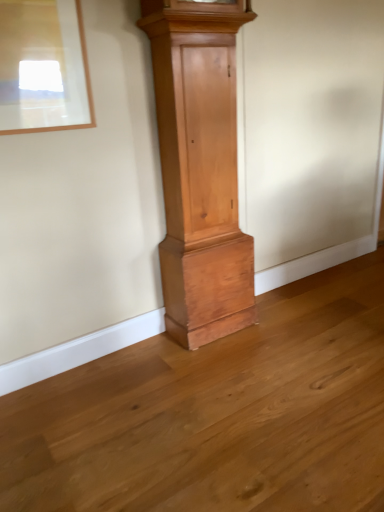
The image size is (384, 512). Describe the element at coordinates (200, 168) in the screenshot. I see `natural wood grandfather clock at center` at that location.

The height and width of the screenshot is (512, 384). What are the coordinates of `natural wood grandfather clock at center` in the screenshot? It's located at (200, 168).

What do you see at coordinates (43, 67) in the screenshot? I see `matte wooden picture frame at upper left` at bounding box center [43, 67].

Image resolution: width=384 pixels, height=512 pixels. I want to click on matte wooden picture frame at upper left, so click(x=43, y=67).

The width and height of the screenshot is (384, 512). In order to click on natural wood grandfather clock at center in this screenshot , I will do [200, 168].

In the image, is matte wooden picture frame at upper left on the left side or the right side of natural wood grandfather clock at center?

matte wooden picture frame at upper left is positioned on natural wood grandfather clock at center's left side.

Is matte wooden picture frame at upper left in front of or behind natural wood grandfather clock at center in the image?

In the image, matte wooden picture frame at upper left appears in front of natural wood grandfather clock at center.

Which is further, [71,29] or [175,139]?

The point [175,139] is behind.

From the image's perspective, relative to natural wood grandfather clock at center, is matte wooden picture frame at upper left above or below?

matte wooden picture frame at upper left is above natural wood grandfather clock at center.

From a real-world perspective, is matte wooden picture frame at upper left on top of natural wood grandfather clock at center?

Yes.

Considering the relative sizes of matte wooden picture frame at upper left and natural wood grandfather clock at center in the image provided, is matte wooden picture frame at upper left wider than natural wood grandfather clock at center?

In fact, matte wooden picture frame at upper left might be narrower than natural wood grandfather clock at center.

In terms of height, does matte wooden picture frame at upper left look taller or shorter compared to natural wood grandfather clock at center?

matte wooden picture frame at upper left is shorter than natural wood grandfather clock at center.

Can you confirm if matte wooden picture frame at upper left is smaller than natural wood grandfather clock at center?

Yes.

Can natural wood grandfather clock at center be found inside matte wooden picture frame at upper left?

No, natural wood grandfather clock at center is not surrounded by matte wooden picture frame at upper left.

Is matte wooden picture frame at upper left placed right next to natural wood grandfather clock at center?

No, matte wooden picture frame at upper left is not next to natural wood grandfather clock at center.

Is matte wooden picture frame at upper left positioned with its back to natural wood grandfather clock at center?

matte wooden picture frame at upper left does not have its back to natural wood grandfather clock at center.

The height and width of the screenshot is (512, 384). In order to click on furniture that is under the matte wooden picture frame at upper left (from a real-world perspective) in this screenshot , I will do `click(200, 168)`.

Between natural wood grandfather clock at center and matte wooden picture frame at upper left, which one appears on the right side from the viewer's perspective?

From the viewer's perspective, natural wood grandfather clock at center appears more on the right side.

Is the depth of natural wood grandfather clock at center less than that of matte wooden picture frame at upper left?

No.

Which point is more distant from viewer, (240, 287) or (76, 55)?

The point (240, 287) is farther from the camera.

From the image's perspective, who appears lower, natural wood grandfather clock at center or matte wooden picture frame at upper left?

natural wood grandfather clock at center is shown below in the image.

From a real-world perspective, between natural wood grandfather clock at center and matte wooden picture frame at upper left, who is vertically lower?

natural wood grandfather clock at center, from a real-world perspective.

Considering the relative sizes of natural wood grandfather clock at center and matte wooden picture frame at upper left in the image provided, is natural wood grandfather clock at center thinner than matte wooden picture frame at upper left?

No, natural wood grandfather clock at center is not thinner than matte wooden picture frame at upper left.

Can you confirm if natural wood grandfather clock at center is shorter than matte wooden picture frame at upper left?

In fact, natural wood grandfather clock at center may be taller than matte wooden picture frame at upper left.

Does natural wood grandfather clock at center have a larger size compared to matte wooden picture frame at upper left?

Indeed, natural wood grandfather clock at center has a larger size compared to matte wooden picture frame at upper left.

Is matte wooden picture frame at upper left a part of natural wood grandfather clock at center?

That's incorrect, matte wooden picture frame at upper left is not inside natural wood grandfather clock at center.

Is natural wood grandfather clock at center far from matte wooden picture frame at upper left?

They are positioned close to each other.

Is natural wood grandfather clock at center oriented towards matte wooden picture frame at upper left?

No, natural wood grandfather clock at center is not aimed at matte wooden picture frame at upper left.

In the scene shown: How different are the orientations of natural wood grandfather clock at center and matte wooden picture frame at upper left in degrees?

There is a 0.0358-degree angle between the facing directions of natural wood grandfather clock at center and matte wooden picture frame at upper left.

The image size is (384, 512). Find the location of `furniture located behind the matte wooden picture frame at upper left`. furniture located behind the matte wooden picture frame at upper left is located at coordinates (200, 168).

Find the location of `picture frame in front of the natural wood grandfather clock at center`. picture frame in front of the natural wood grandfather clock at center is located at coordinates (43, 67).

You are a GUI agent. You are given a task and a screenshot of the screen. Output one action in this format:
    pyautogui.click(x=<x>, y=<y>)
    Task: Click on the picture frame on the left of natural wood grandfather clock at center
    
    Given the screenshot: What is the action you would take?
    pyautogui.click(x=43, y=67)